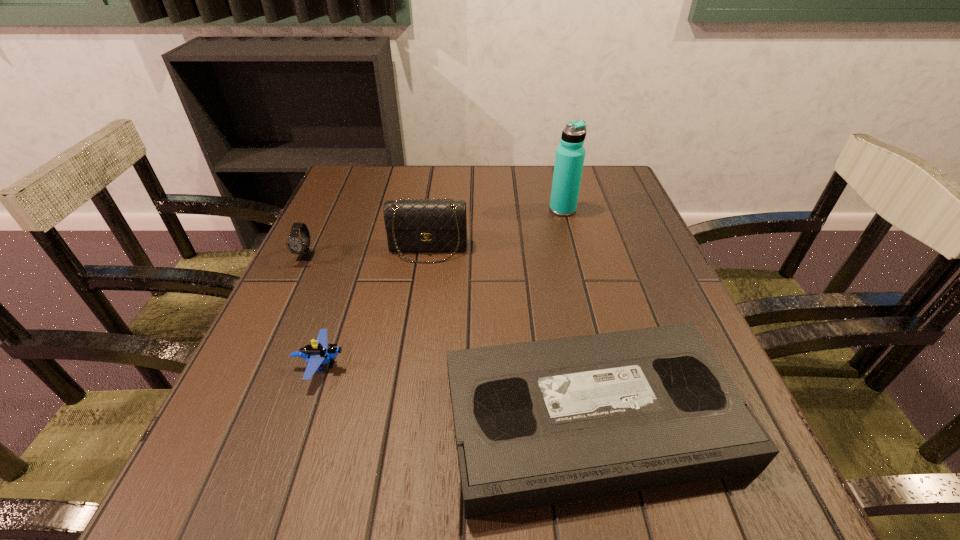
The width and height of the screenshot is (960, 540). Identify the location of free space between the videotape and the leftmost object. (448, 337).

Where is `empty space between the second object from left to right and the leftmost object`? The image size is (960, 540). empty space between the second object from left to right and the leftmost object is located at coordinates (314, 310).

Where is `empty space that is in between the clutch bag and the fourth object from right to left`? Image resolution: width=960 pixels, height=540 pixels. empty space that is in between the clutch bag and the fourth object from right to left is located at coordinates (374, 307).

Point out which object is positioned as the nearest to the fourth object from right to left. Please provide its 2D coordinates. Your answer should be formatted as a tuple, i.e. [(x, y)], where the tuple contains the x and y coordinates of a point satisfying the conditions above.

[(539, 423)]

At what (x,y) coordinates should I click in order to perform the action: click on object that is the fourth closest one to the shortest object. Please return your answer as a coordinate pair (x, y). The width and height of the screenshot is (960, 540). Looking at the image, I should click on [569, 160].

The image size is (960, 540). Find the location of `free region that satisfies the following two spatial constraints: 1. on the front flap of the second tallest object; 2. on the front-facing side of the Lego`. free region that satisfies the following two spatial constraints: 1. on the front flap of the second tallest object; 2. on the front-facing side of the Lego is located at coordinates (412, 364).

You are a GUI agent. You are given a task and a screenshot of the screen. Output one action in this format:
    pyautogui.click(x=<x>, y=<y>)
    Task: Click on the vacant space that satisfies the following two spatial constraints: 1. on the back side of the videotape; 2. on the front-facing side of the second object from left to right
    The image size is (960, 540).
    Given the screenshot: What is the action you would take?
    pyautogui.click(x=580, y=364)

Locate an element on the screen. vacant area that satisfies the following two spatial constraints: 1. on the front-facing side of the shortest object; 2. on the right side of the fourth object from right to left is located at coordinates (303, 417).

In order to click on free spot that satisfies the following two spatial constraints: 1. on the front-facing side of the videotape; 2. on the left side of the second object from left to right in this screenshot , I will do `click(303, 417)`.

The width and height of the screenshot is (960, 540). In order to click on vacant area that satisfies the following two spatial constraints: 1. on the face of the videotape; 2. on the right side of the watch in this screenshot , I will do `click(229, 417)`.